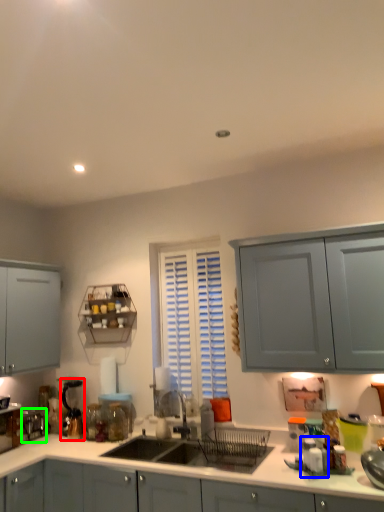
Question: Which object is positioned farthest from coffee machine (highlighted by a red box)? Select from appliance (highlighted by a blue box) and appliance (highlighted by a green box).

Choices:
 (A) appliance
 (B) appliance

Answer: (A)